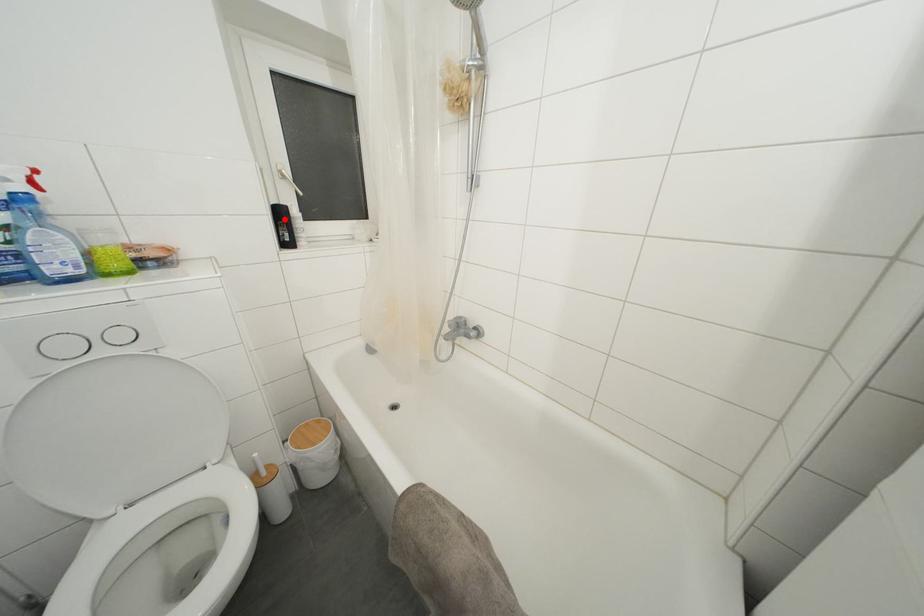
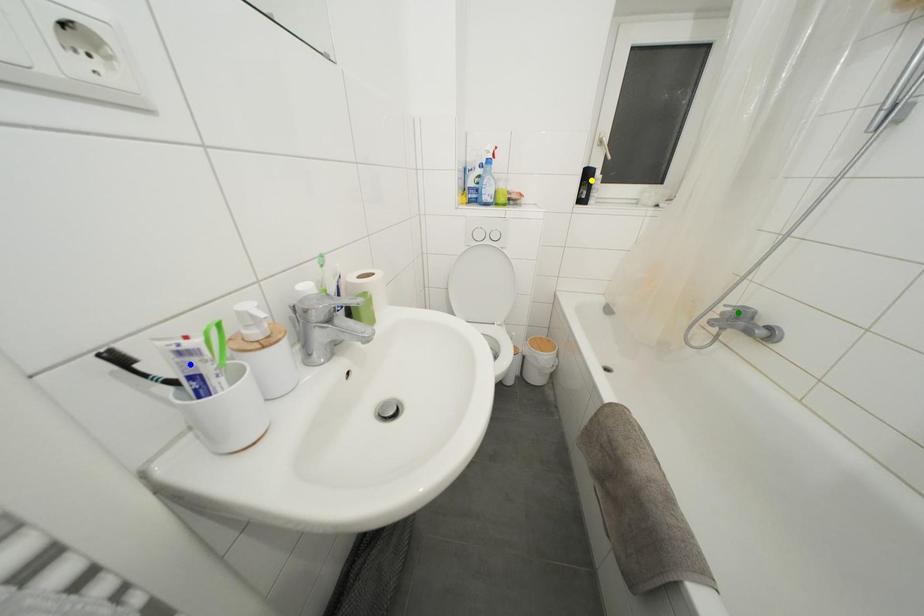
Question: I am providing you with two images of the same scene from different viewpoints. A red point is marked on the first image. You are given multiple points on the second image. Which point in image 2 represents the same 3d spot as the red point in image 1?

Choices:
 (A) green point
 (B) blue point
 (C) yellow point

Answer: (C)